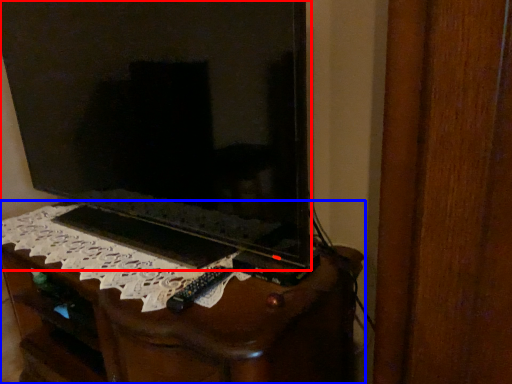
Question: Which point is closer to the camera, television (highlighted by a red box) or furniture (highlighted by a blue box)?

Choices:
 (A) television
 (B) furniture

Answer: (A)